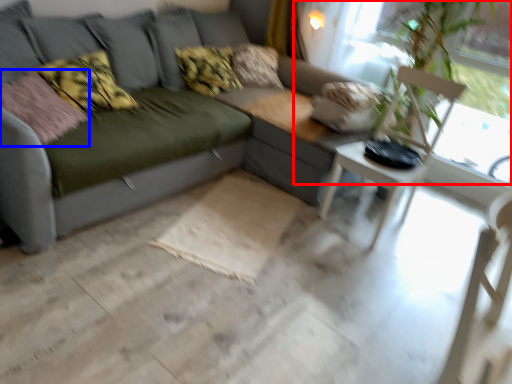
Question: Which object appears closest to the camera in this image, window screen (highlighted by a red box) or pillow (highlighted by a blue box)?

Choices:
 (A) window screen
 (B) pillow

Answer: (B)